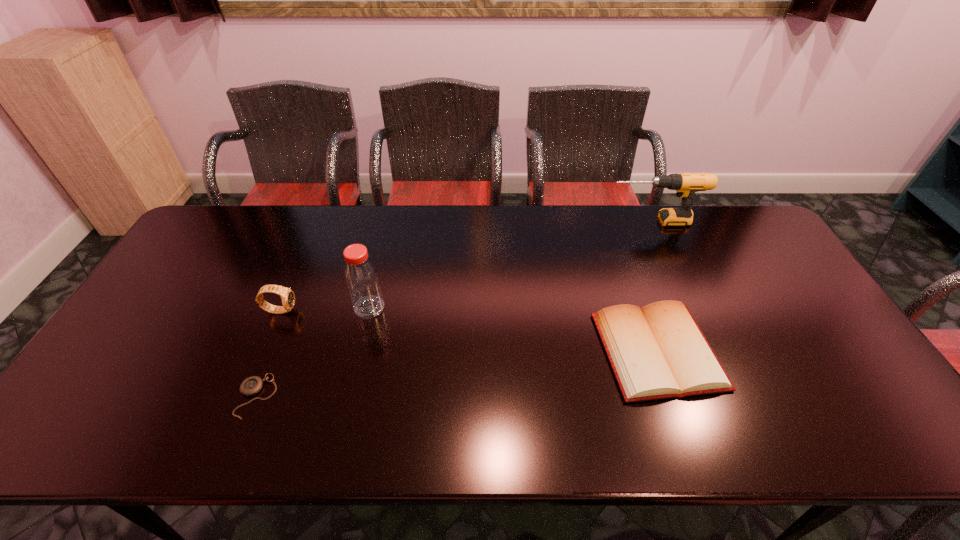
Choose which object is the nearest neighbor to the drill. Please provide its 2D coordinates. Your answer should be formatted as a tuple, i.e. [(x, y)], where the tuple contains the x and y coordinates of a point satisfying the conditions above.

[(659, 351)]

Select which object appears as the closest to the third object from left to right. Please provide its 2D coordinates. Your answer should be formatted as a tuple, i.e. [(x, y)], where the tuple contains the x and y coordinates of a point satisfying the conditions above.

[(288, 298)]

Locate an element on the screen. The image size is (960, 540). free point that satisfies the following two spatial constraints: 1. on the face of the pocket watch; 2. on the left side of the third shortest object is located at coordinates (244, 396).

Where is `free space that satisfies the following two spatial constraints: 1. on the back side of the pocket watch; 2. on the face of the watch`? The height and width of the screenshot is (540, 960). free space that satisfies the following two spatial constraints: 1. on the back side of the pocket watch; 2. on the face of the watch is located at coordinates (291, 310).

This screenshot has width=960, height=540. What are the coordinates of `free space that satisfies the following two spatial constraints: 1. on the face of the third shortest object; 2. on the right side of the second shortest object` in the screenshot? It's located at (263, 351).

Locate an element on the screen. vacant position in the image that satisfies the following two spatial constraints: 1. on the face of the watch; 2. on the left side of the pocket watch is located at coordinates (244, 396).

This screenshot has width=960, height=540. Identify the location of vacant area in the image that satisfies the following two spatial constraints: 1. on the face of the third tallest object; 2. on the back side of the second shortest object. (263, 351).

The width and height of the screenshot is (960, 540). Identify the location of free region that satisfies the following two spatial constraints: 1. on the face of the third shortest object; 2. on the back side of the Bible. (263, 351).

This screenshot has height=540, width=960. I want to click on vacant space that satisfies the following two spatial constraints: 1. on the face of the Bible; 2. on the left side of the watch, so click(x=263, y=351).

What are the coordinates of `blank space that satisfies the following two spatial constraints: 1. on the face of the third shortest object; 2. on the back side of the Bible` in the screenshot? It's located at [263, 351].